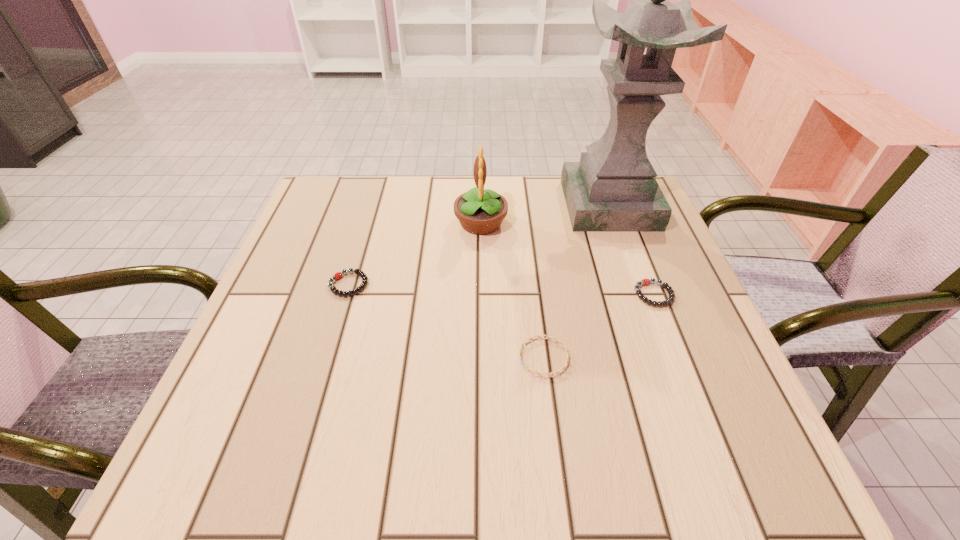
Find the location of a particular element. The width and height of the screenshot is (960, 540). vacant space located 0.200m on the face of the second object from left to right is located at coordinates (374, 222).

I want to click on free spot located 0.250m on the front of the leftmost object, so pyautogui.click(x=312, y=408).

This screenshot has height=540, width=960. Find the location of `vacant region located 0.170m on the left of the rightmost bracelet`. vacant region located 0.170m on the left of the rightmost bracelet is located at coordinates (554, 294).

You are a GUI agent. You are given a task and a screenshot of the screen. Output one action in this format:
    pyautogui.click(x=<x>, y=<y>)
    Task: Click on the free region located on the surface of the third object from right to left showing star-shaped elements
    The width and height of the screenshot is (960, 540).
    Given the screenshot: What is the action you would take?
    pyautogui.click(x=383, y=357)

Where is `free point located on the surface of the third object from right to left showing star-shaped elements`? free point located on the surface of the third object from right to left showing star-shaped elements is located at coordinates (372, 357).

The width and height of the screenshot is (960, 540). I want to click on free space located 0.350m on the surface of the third object from right to left showing star-shaped elements, so coord(328,357).

You are a GUI agent. You are given a task and a screenshot of the screen. Output one action in this format:
    pyautogui.click(x=<x>, y=<y>)
    Task: Click on the sculpture that is at the far edge
    The width and height of the screenshot is (960, 540).
    Given the screenshot: What is the action you would take?
    613,188

At what (x,y) coordinates should I click in order to perform the action: click on sunflower at the far edge. Please return your answer as a coordinate pair (x, y). The image size is (960, 540). Looking at the image, I should click on (480, 212).

The width and height of the screenshot is (960, 540). Find the location of `object located in the left edge section of the desktop`. object located in the left edge section of the desktop is located at coordinates (338, 275).

At what (x,y) coordinates should I click in order to perform the action: click on sculpture present at the right edge. Please return your answer as a coordinate pair (x, y). Looking at the image, I should click on (613, 188).